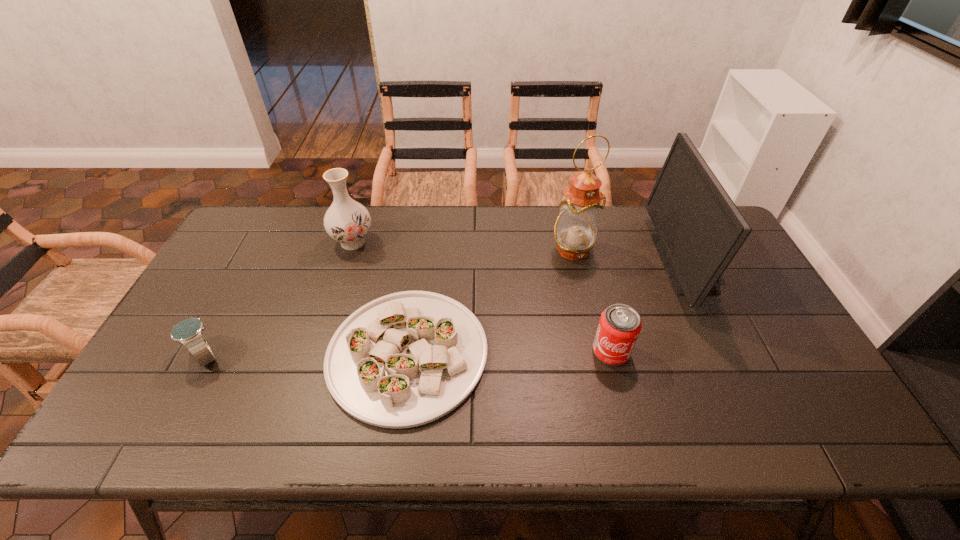
Find the location of a particular element. The width and height of the screenshot is (960, 540). vacant space located 0.210m on the screen side of the computer monitor is located at coordinates (593, 263).

Where is `blank area located 0.150m on the screen side of the computer monitor`? The height and width of the screenshot is (540, 960). blank area located 0.150m on the screen side of the computer monitor is located at coordinates (612, 263).

The width and height of the screenshot is (960, 540). I want to click on vacant area located on the front of the vase, so click(x=338, y=289).

The height and width of the screenshot is (540, 960). I want to click on free space located 0.380m on the right of the can, so click(x=777, y=352).

The width and height of the screenshot is (960, 540). I want to click on blank space located 0.100m on the back of the second shortest object, so click(230, 310).

Where is `free point located 0.120m on the left of the shortest object`? This screenshot has height=540, width=960. free point located 0.120m on the left of the shortest object is located at coordinates (281, 354).

Where is `oil lamp present at the far edge`? oil lamp present at the far edge is located at coordinates (575, 230).

The image size is (960, 540). In order to click on computer monitor positioned at the far edge in this screenshot , I will do `click(699, 228)`.

Where is `vase located in the far edge section of the desktop`? vase located in the far edge section of the desktop is located at coordinates (x=347, y=221).

Locate an element on the screen. This screenshot has height=540, width=960. object that is positioned at the near edge is located at coordinates (406, 359).